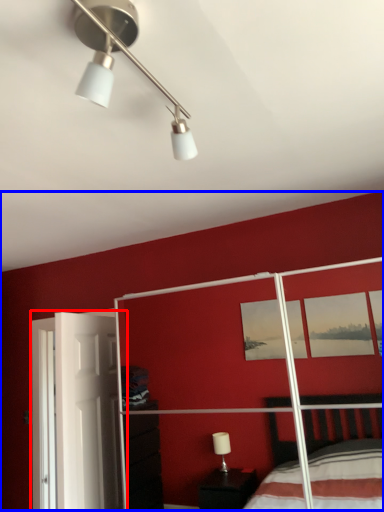
Question: Which of the following is the farthest to the observer, screen door (highlighted by a red box) or backdrop (highlighted by a blue box)?

Choices:
 (A) screen door
 (B) backdrop

Answer: (A)